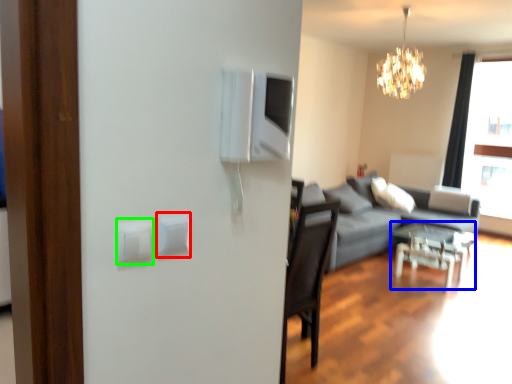
Question: Estimate the real-world distances between objects in this image. Which object is closer to light switch (highlighted by a red box), table (highlighted by a blue box) or light switch (highlighted by a green box)?

Choices:
 (A) table
 (B) light switch

Answer: (B)